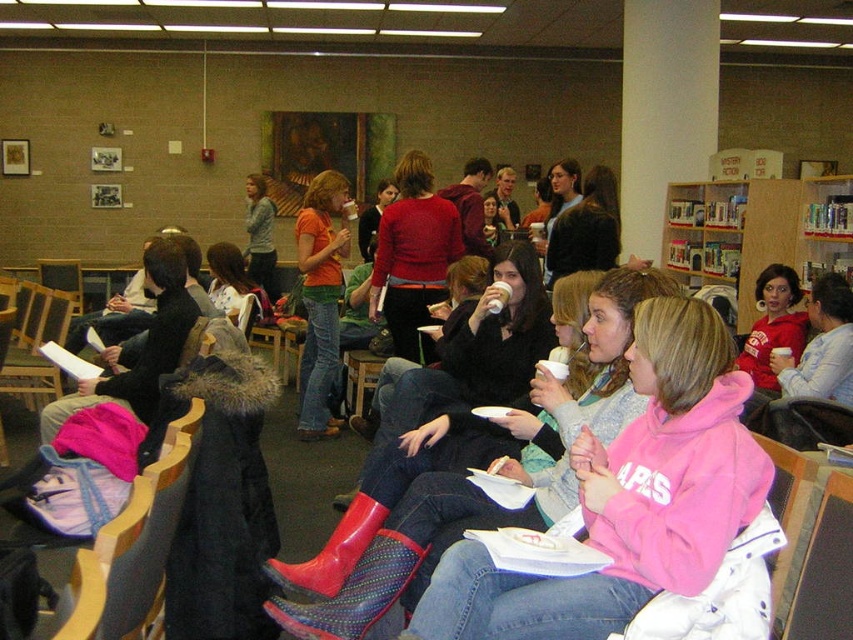
This screenshot has width=853, height=640. Describe the element at coordinates (412, 481) in the screenshot. I see `rubber boots at center` at that location.

Can you confirm if rubber boots at center is taller than matte red sweater at center?

No.

Is point (410, 470) closer to viewer compared to point (416, 179)?

That is True.

At what (x,y) coordinates should I click in order to perform the action: click on rubber boots at center. Please return your answer as a coordinate pair (x, y). This screenshot has height=640, width=853. Looking at the image, I should click on (412, 481).

Is pink fleece sweatshirt at center to the right of matte red sweater at center from the viewer's perspective?

Yes, pink fleece sweatshirt at center is to the right of matte red sweater at center.

Does point (424, 602) lie in front of point (399, 356)?

Yes, point (424, 602) is closer to viewer.

Between point (619, 598) and point (425, 211), which one is positioned in front?

Point (619, 598) is more forward.

I want to click on pink fleece sweatshirt at center, so click(x=630, y=497).

Is matte red sweater at center bigger than matte black jacket at center?

Correct, matte red sweater at center is larger in size than matte black jacket at center.

You are a GUI agent. You are given a task and a screenshot of the screen. Output one action in this format:
    pyautogui.click(x=<x>, y=<y>)
    Task: Click on the matte red sweater at center
    This screenshot has width=853, height=640.
    Given the screenshot: What is the action you would take?
    pyautogui.click(x=413, y=256)